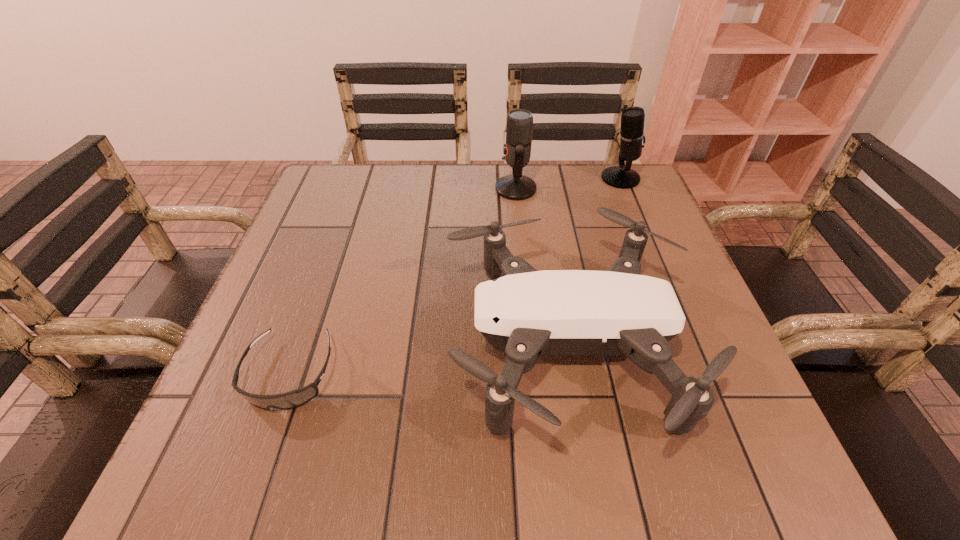
Where is `the left microphone`? the left microphone is located at coordinates (x=517, y=150).

Locate an element on the screen. This screenshot has width=960, height=540. the right microphone is located at coordinates (632, 137).

Locate an element on the screen. This screenshot has width=960, height=540. the second shortest object is located at coordinates (526, 313).

I want to click on goggles, so click(x=295, y=398).

The width and height of the screenshot is (960, 540). Find the location of `the shortest object`. the shortest object is located at coordinates (295, 398).

Locate an element on the screen. blank space located on the side of the left microphone with the red ring is located at coordinates (468, 189).

Where is `vacant point located 0.330m on the side of the left microphone with the red ring`? This screenshot has width=960, height=540. vacant point located 0.330m on the side of the left microphone with the red ring is located at coordinates (368, 189).

Locate an element on the screen. This screenshot has width=960, height=540. vacant area situated on the side of the left microphone with the red ring is located at coordinates (345, 189).

What are the coordinates of `free space located 0.160m on the left of the right microphone` in the screenshot? It's located at (541, 178).

At what (x,y) coordinates should I click in order to perform the action: click on free location located 0.130m on the camera side of the drone. Please return your answer as a coordinate pair (x, y). Image resolution: width=960 pixels, height=540 pixels. Looking at the image, I should click on (374, 344).